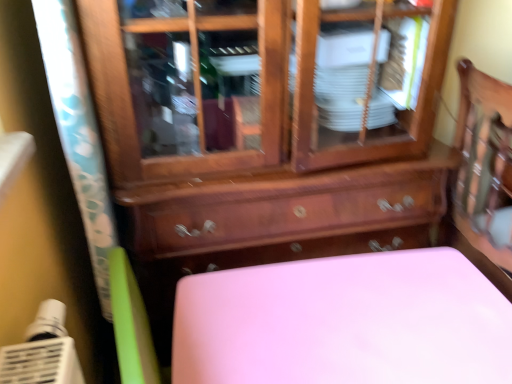
Question: Does point (369, 122) appear closer or farther from the camera than point (287, 321)?

Choices:
 (A) farther
 (B) closer

Answer: (A)

Question: In the image, is wooden cabinet at center positioned in front of or behind pink matte table at lower center?

Choices:
 (A) behind
 (B) front

Answer: (B)

Question: From a real-world perspective, is wooden cabinet at center above or below pink matte table at lower center?

Choices:
 (A) below
 (B) above

Answer: (B)

Question: Looking at the image, does pink matte table at lower center seem bigger or smaller compared to wooden cabinet at center?

Choices:
 (A) small
 (B) big

Answer: (A)

Question: Considering the positions of pink matte table at lower center and wooden cabinet at center in the image, is pink matte table at lower center taller or shorter than wooden cabinet at center?

Choices:
 (A) tall
 (B) short

Answer: (B)

Question: Would you say pink matte table at lower center is to the left or to the right of wooden cabinet at center in the picture?

Choices:
 (A) left
 (B) right

Answer: (B)

Question: Is pink matte table at lower center situated inside wooden cabinet at center or outside?

Choices:
 (A) inside
 (B) outside

Answer: (B)